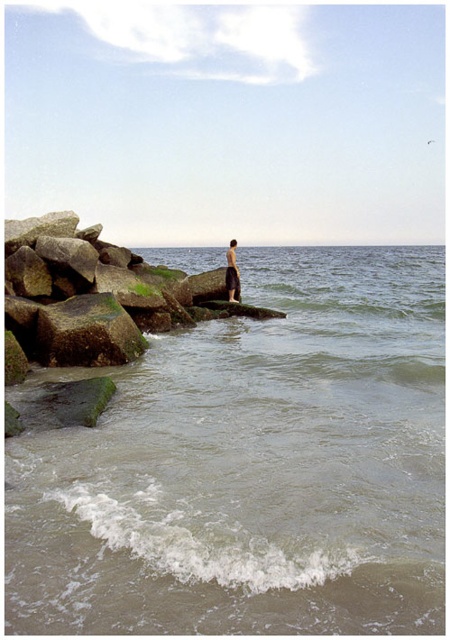
Question: Can you confirm if greenish water at lower left is thinner than green mossy rock at left?

Choices:
 (A) yes
 (B) no

Answer: (B)

Question: Which point appears farthest from the camera in this image?

Choices:
 (A) (428, 252)
 (B) (233, 260)
 (C) (133, 339)

Answer: (A)

Question: Does green mossy rock at left come behind skinny man at center?

Choices:
 (A) yes
 (B) no

Answer: (B)

Question: Which object appears farthest from the camera in this image?

Choices:
 (A) green mossy rock at left
 (B) skinny man at center
 (C) greenish water at lower left

Answer: (B)

Question: Which point appears closest to the camera in this image?

Choices:
 (A) (229, 268)
 (B) (265, 508)
 (C) (125, 310)

Answer: (B)

Question: Can you confirm if greenish water at lower left is thinner than skinny man at center?

Choices:
 (A) yes
 (B) no

Answer: (B)